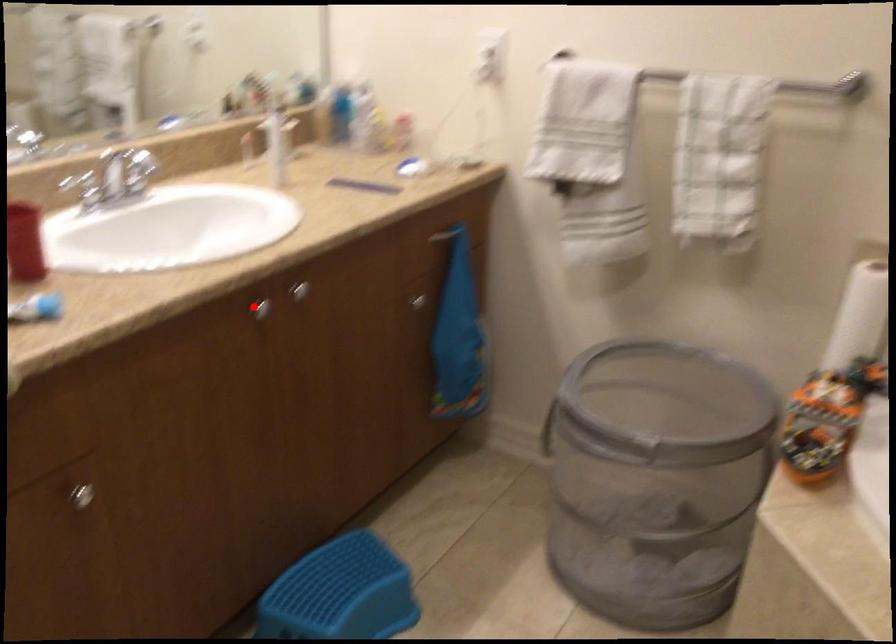
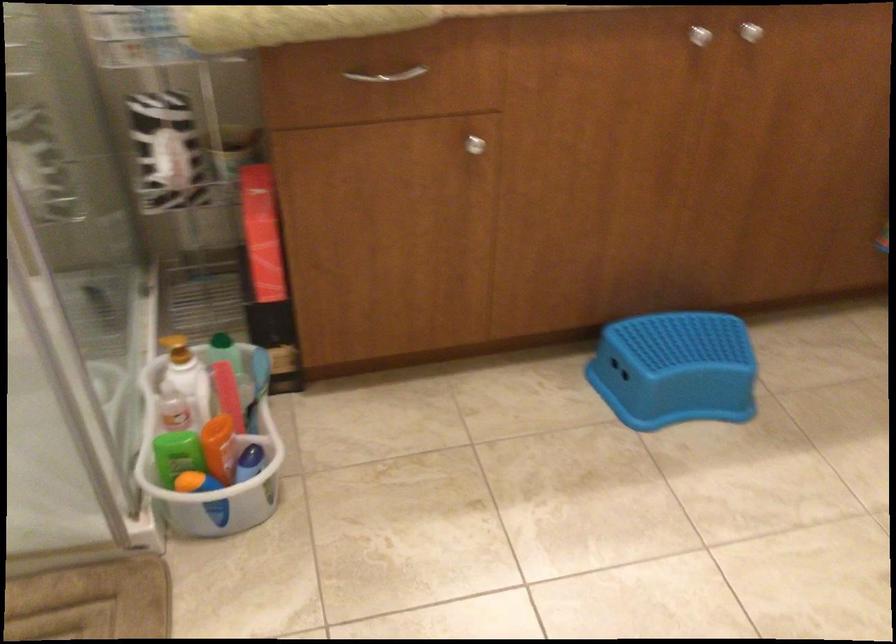
The point at the highlighted location is marked in the first image. Where is the corresponding point in the second image?

(700, 35)